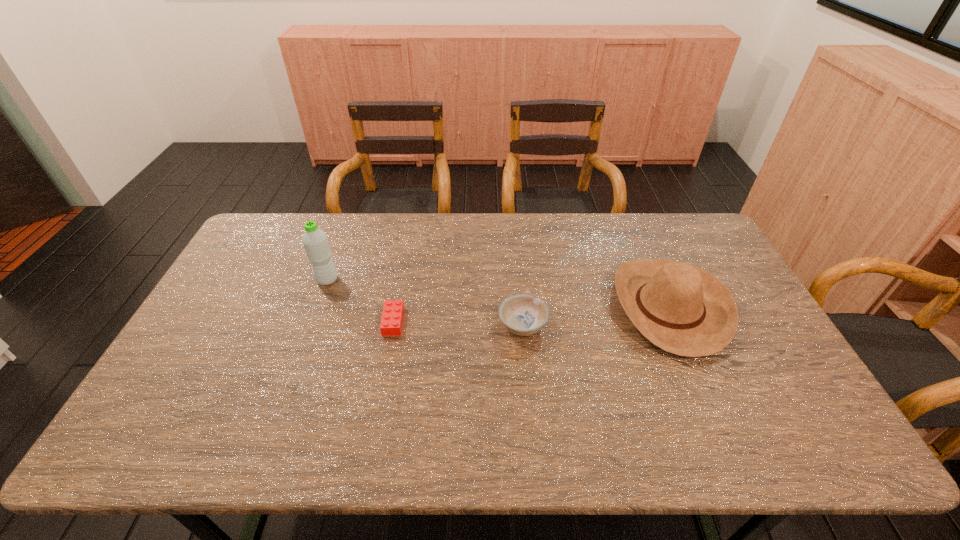
Locate an element on the screen. The width and height of the screenshot is (960, 540). free space between the third object from left to right and the shortest object is located at coordinates click(x=458, y=323).

Where is `free space between the third tallest object and the tallest object`? The width and height of the screenshot is (960, 540). free space between the third tallest object and the tallest object is located at coordinates (425, 302).

Image resolution: width=960 pixels, height=540 pixels. In order to click on vacant area that lies between the third tallest object and the leftmost object in this screenshot , I will do `click(425, 302)`.

Where is `unoccupied area between the leftmost object and the shortest object`? This screenshot has width=960, height=540. unoccupied area between the leftmost object and the shortest object is located at coordinates (360, 301).

What are the coordinates of `vacant space that is in between the water bottle and the second object from left to right` in the screenshot? It's located at (360, 301).

Where is `object that can be found as the closest to the shortest object`? The image size is (960, 540). object that can be found as the closest to the shortest object is located at coordinates (315, 241).

Identify which object is located as the third nearest to the bowl. Please provide its 2D coordinates. Your answer should be formatted as a tuple, i.e. [(x, y)], where the tuple contains the x and y coordinates of a point satisfying the conditions above.

[(315, 241)]

Find the location of `free space that satisfies the following two spatial constraints: 1. on the front-facing side of the cowboy hat; 2. on the front side of the second shortest object`. free space that satisfies the following two spatial constraints: 1. on the front-facing side of the cowboy hat; 2. on the front side of the second shortest object is located at coordinates (677, 325).